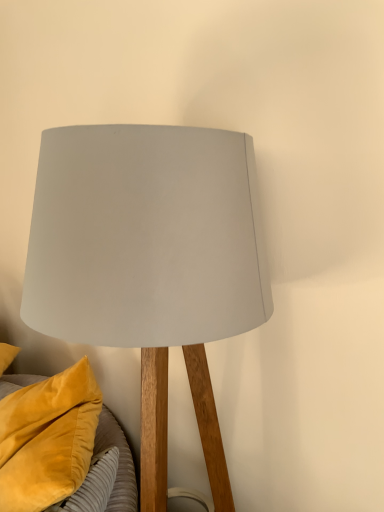
What do you see at coordinates (48, 438) in the screenshot? The image size is (384, 512). I see `velvet yellow pillow at lower left` at bounding box center [48, 438].

This screenshot has width=384, height=512. I want to click on velvet yellow pillow at lower left, so [48, 438].

Describe the element at coordinates (150, 263) in the screenshot. I see `matte gray lampshade at center` at that location.

Locate an element on the screen. matte gray lampshade at center is located at coordinates (150, 263).

This screenshot has height=512, width=384. In order to click on velvet yellow pillow at lower left in this screenshot , I will do `click(48, 438)`.

Considering the positions of objects velvet yellow pillow at lower left and matte gray lampshade at center in the image provided, who is more to the left, velvet yellow pillow at lower left or matte gray lampshade at center?

Positioned to the left is velvet yellow pillow at lower left.

Does velvet yellow pillow at lower left lie behind matte gray lampshade at center?

Yes, it is.

Is point (16, 474) positioned in front of point (142, 142)?

No, it is not.

From the image's perspective, does velvet yellow pillow at lower left appear lower than matte gray lampshade at center?

Yes, from the image's perspective, velvet yellow pillow at lower left is below matte gray lampshade at center.

From a real-world perspective, is velvet yellow pillow at lower left positioned over matte gray lampshade at center based on gravity?

No, from a real-world perspective, velvet yellow pillow at lower left is not above matte gray lampshade at center.

Which of these two, velvet yellow pillow at lower left or matte gray lampshade at center, is thinner?

velvet yellow pillow at lower left is thinner.

Considering the sizes of velvet yellow pillow at lower left and matte gray lampshade at center in the image, is velvet yellow pillow at lower left taller or shorter than matte gray lampshade at center?

In the image, velvet yellow pillow at lower left appears to be shorter than matte gray lampshade at center.

Considering the relative sizes of velvet yellow pillow at lower left and matte gray lampshade at center in the image provided, is velvet yellow pillow at lower left smaller than matte gray lampshade at center?

Yes.

Is matte gray lampshade at center inside velvet yellow pillow at lower left?

No, matte gray lampshade at center is not a part of velvet yellow pillow at lower left.

In the scene shown: Is velvet yellow pillow at lower left far from matte gray lampshade at center?

Actually, velvet yellow pillow at lower left and matte gray lampshade at center are a little close together.

Could you tell me if velvet yellow pillow at lower left is facing matte gray lampshade at center?

No, velvet yellow pillow at lower left is not oriented towards matte gray lampshade at center.

How different are the orientations of velvet yellow pillow at lower left and matte gray lampshade at center in degrees?

They differ by 80.2 degrees in their facing directions.

Measure the distance between velvet yellow pillow at lower left and matte gray lampshade at center.

They are 20.16 inches apart.

Where is `lamp lying on the right of velvet yellow pillow at lower left`? The width and height of the screenshot is (384, 512). lamp lying on the right of velvet yellow pillow at lower left is located at coordinates (150, 263).

Which is more to the left, matte gray lampshade at center or velvet yellow pillow at lower left?

Positioned to the left is velvet yellow pillow at lower left.

Between matte gray lampshade at center and velvet yellow pillow at lower left, which one is positioned in front?

matte gray lampshade at center is in front.

Considering the points (221, 187) and (43, 401), which point is behind, point (221, 187) or point (43, 401)?

The point (43, 401) is farther.

From the image's perspective, is matte gray lampshade at center on top of velvet yellow pillow at lower left?

Yes, from the image's perspective, matte gray lampshade at center is on top of velvet yellow pillow at lower left.

From a real-world perspective, relative to velvet yellow pillow at lower left, is matte gray lampshade at center vertically above or below?

matte gray lampshade at center is above velvet yellow pillow at lower left.

Does matte gray lampshade at center have a lesser width compared to velvet yellow pillow at lower left?

No.

Considering the relative sizes of matte gray lampshade at center and velvet yellow pillow at lower left in the image provided, is matte gray lampshade at center taller than velvet yellow pillow at lower left?

Correct, matte gray lampshade at center is much taller as velvet yellow pillow at lower left.

Between matte gray lampshade at center and velvet yellow pillow at lower left, which one has smaller size?

velvet yellow pillow at lower left is smaller.

Could velvet yellow pillow at lower left be considered to be inside matte gray lampshade at center?

No, velvet yellow pillow at lower left is located outside of matte gray lampshade at center.

Is matte gray lampshade at center positioned far away from velvet yellow pillow at lower left?

No, matte gray lampshade at center is not far away from velvet yellow pillow at lower left.

Does matte gray lampshade at center turn towards velvet yellow pillow at lower left?

No, matte gray lampshade at center does not turn towards velvet yellow pillow at lower left.

Measure the distance between matte gray lampshade at center and velvet yellow pillow at lower left.

A distance of 20.16 inches exists between matte gray lampshade at center and velvet yellow pillow at lower left.

In order to click on pillow on the left side of matte gray lampshade at center in this screenshot , I will do pos(48,438).

Find the location of a particular element. lamp above the velvet yellow pillow at lower left (from a real-world perspective) is located at coordinates (150, 263).

The width and height of the screenshot is (384, 512). In order to click on pillow that appears on the left of matte gray lampshade at center in this screenshot , I will do `click(48, 438)`.